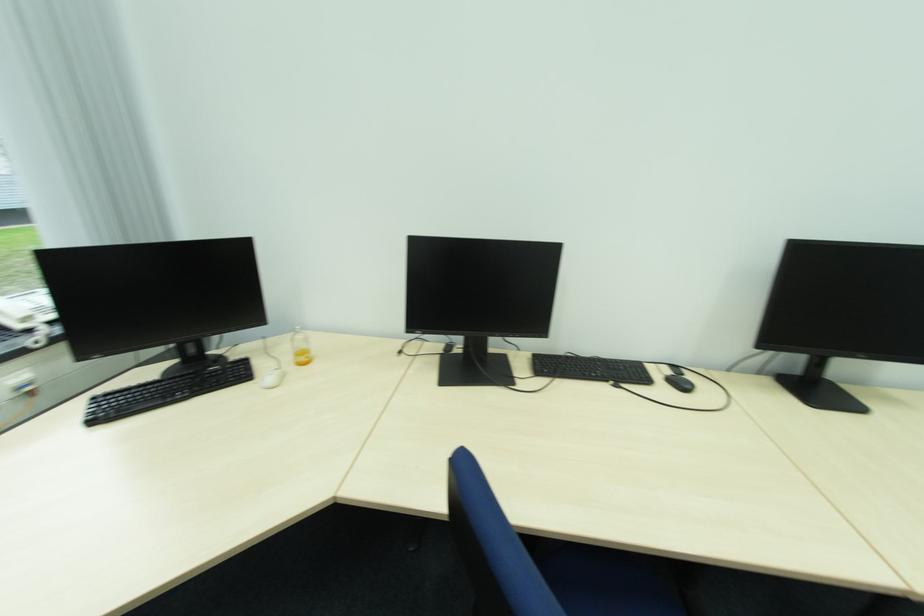
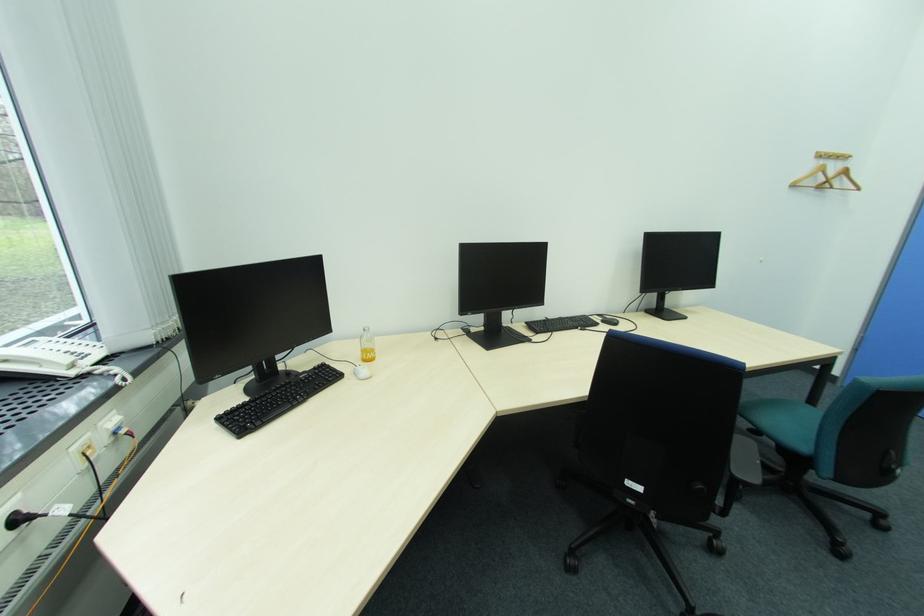
Question: The camera is either moving clockwise (left) or counter-clockwise (right) around the object. The first image is from the beginning of the video and the second image is from the end. Is the camera moving left or right when shooting the video?

Choices:
 (A) Left
 (B) Right

Answer: (A)